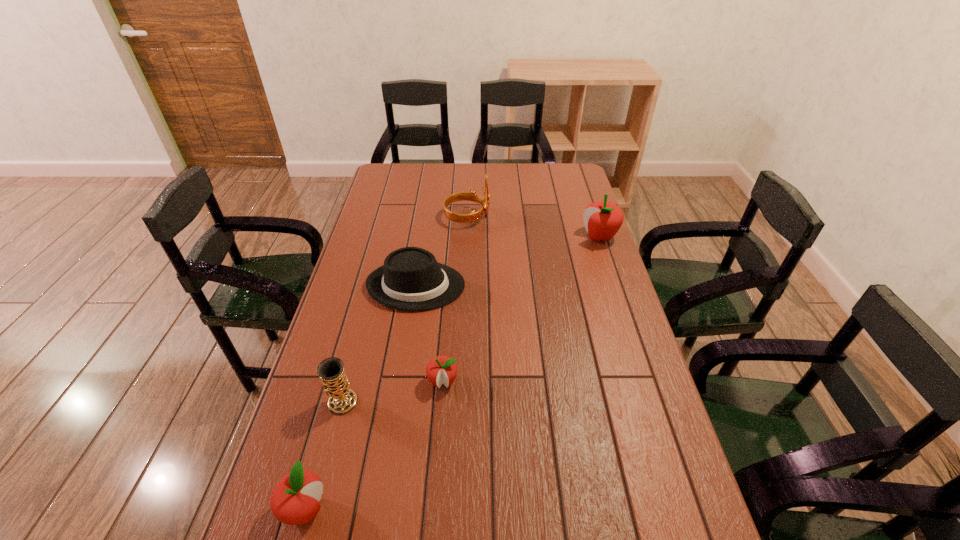
Locate an element on the screen. Image resolution: width=960 pixels, height=540 pixels. object present at the near left corner is located at coordinates [294, 500].

This screenshot has width=960, height=540. Find the location of `free space at the far edge`. free space at the far edge is located at coordinates (452, 177).

This screenshot has width=960, height=540. What are the coordinates of `free location at the near edge` in the screenshot? It's located at (472, 539).

What are the coordinates of `vacant space at the left edge` in the screenshot? It's located at (364, 234).

In the image, there is a desktop. Where is `free space at the right edge`? Image resolution: width=960 pixels, height=540 pixels. free space at the right edge is located at coordinates (660, 499).

Locate an element on the screen. This screenshot has height=540, width=960. free space at the far left corner of the desktop is located at coordinates pyautogui.click(x=407, y=187).

What are the coordinates of `vacant space at the near left corner of the desktop` in the screenshot? It's located at (323, 508).

The height and width of the screenshot is (540, 960). In the image, there is a desktop. Identify the location of vacant area at the far right corner. (562, 167).

In order to click on vacant area between the second farthest apple and the nearest object in this screenshot , I will do `click(374, 446)`.

The width and height of the screenshot is (960, 540). In order to click on free spot between the tiara and the second tallest apple in this screenshot , I will do `click(386, 363)`.